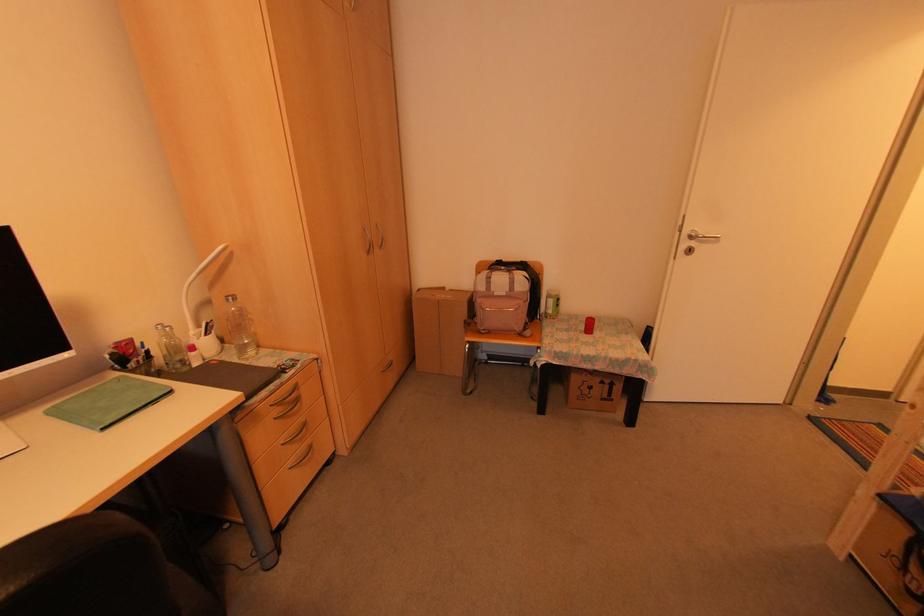
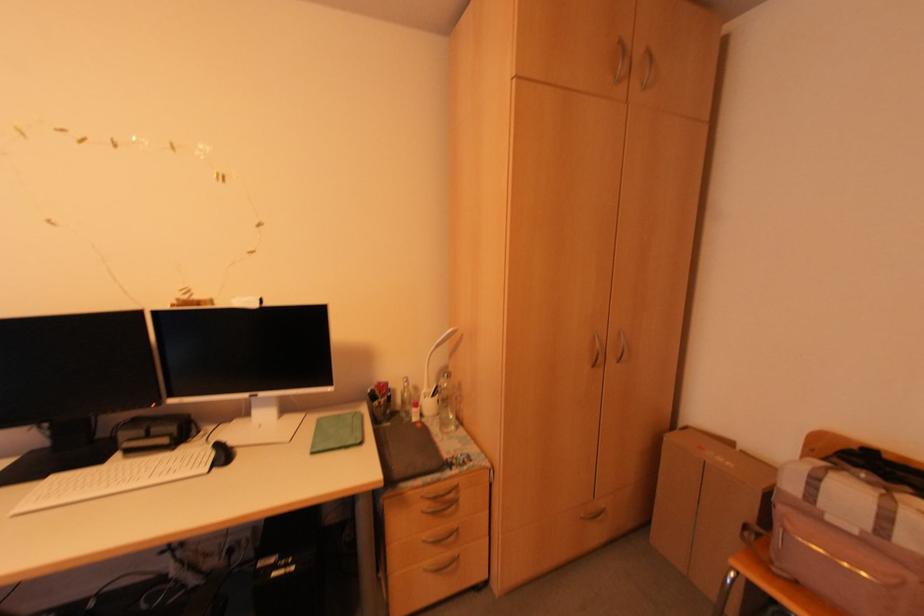
Find the pixel in the second image that matches the point at 233,299 in the first image.

(446, 377)